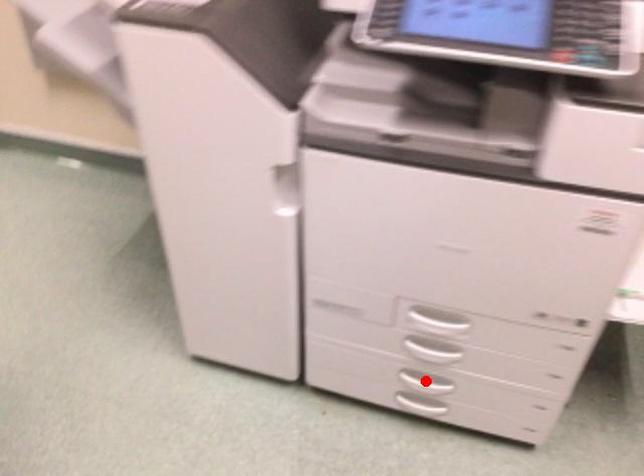
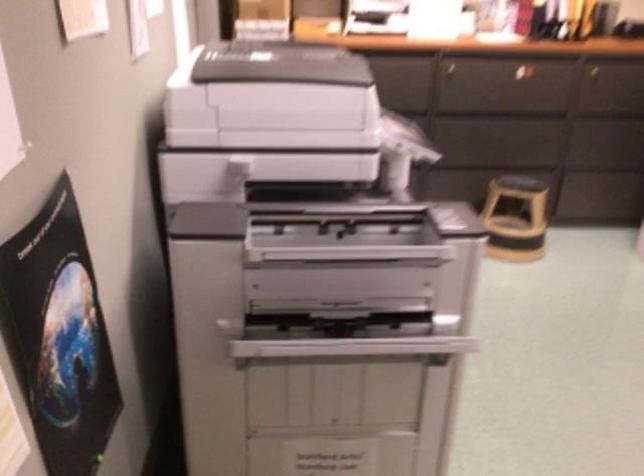
Question: I am providing you with two images of the same scene from different viewpoints. A red point is marked on the first image. Is the red point's position out of view in image 2?

Choices:
 (A) Yes
 (B) No

Answer: (A)